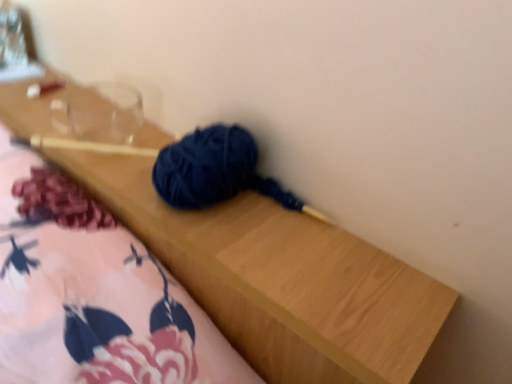
The height and width of the screenshot is (384, 512). What do you see at coordinates (93, 298) in the screenshot?
I see `fluffy pink blanket at lower left` at bounding box center [93, 298].

Image resolution: width=512 pixels, height=384 pixels. What do you see at coordinates (11, 37) in the screenshot?
I see `transparent glass jar at upper left` at bounding box center [11, 37].

This screenshot has height=384, width=512. In order to click on fluffy pink blanket at lower left in this screenshot , I will do `click(93, 298)`.

From the image's perspective, which object appears higher, transparent glass jar at upper left or transparent glass at upper left?

From the image's view, transparent glass jar at upper left is above.

Locate an element on the screen. Image resolution: width=512 pixels, height=384 pixels. clear below the transparent glass jar at upper left (from the image's perspective) is located at coordinates (99, 113).

In terms of width, does transparent glass jar at upper left look wider or thinner when compared to transparent glass at upper left?

Clearly, transparent glass jar at upper left has more width compared to transparent glass at upper left.

Based on their sizes in the image, would you say transparent glass jar at upper left is bigger or smaller than transparent glass at upper left?

Considering their sizes, transparent glass jar at upper left takes up more space than transparent glass at upper left.

Is transparent glass jar at upper left in front of or behind fluffy pink blanket at lower left in the image?

Clearly, transparent glass jar at upper left is behind fluffy pink blanket at lower left.

From a real-world perspective, is transparent glass jar at upper left physically below fluffy pink blanket at lower left?

No, from a real-world perspective, transparent glass jar at upper left is not beneath fluffy pink blanket at lower left.

Is point (18, 35) positioned behind point (163, 278)?

Yes, it is.

Is transparent glass jar at upper left at the right side of fluffy pink blanket at lower left?

In fact, transparent glass jar at upper left is to the left of fluffy pink blanket at lower left.

From the image's perspective, is fluffy pink blanket at lower left located above transparent glass at upper left?

No, from the image's perspective, fluffy pink blanket at lower left is not over transparent glass at upper left.

Between fluffy pink blanket at lower left and transparent glass at upper left, which one has more height?

With more height is fluffy pink blanket at lower left.

Considering the positions of objects fluffy pink blanket at lower left and transparent glass at upper left in the image provided, who is more to the right, fluffy pink blanket at lower left or transparent glass at upper left?

fluffy pink blanket at lower left.

This screenshot has height=384, width=512. What are the coordinates of `clear on the left of fluffy pink blanket at lower left` in the screenshot? It's located at (99, 113).

From a real-world perspective, is transparent glass at upper left positioned above or below fluffy pink blanket at lower left?

Clearly, from a real-world perspective, transparent glass at upper left is above fluffy pink blanket at lower left.

Is transparent glass at upper left not inside fluffy pink blanket at lower left?

Yes, transparent glass at upper left is located beyond the bounds of fluffy pink blanket at lower left.

Which object is more forward, transparent glass at upper left or fluffy pink blanket at lower left?

fluffy pink blanket at lower left is closer to the camera.

Does transparent glass at upper left have a lesser width compared to fluffy pink blanket at lower left?

Yes, transparent glass at upper left is thinner than fluffy pink blanket at lower left.

Is transparent glass at upper left facing towards transparent glass jar at upper left?

No, transparent glass at upper left is not turned towards transparent glass jar at upper left.

Where is `clear in front of the transparent glass jar at upper left`? clear in front of the transparent glass jar at upper left is located at coordinates 99,113.

From a real-world perspective, who is located lower, transparent glass at upper left or transparent glass jar at upper left?

From a 3D spatial view, transparent glass at upper left is below.

Looking at this image, considering the positions of objects transparent glass at upper left and transparent glass jar at upper left in the image provided, who is more to the right, transparent glass at upper left or transparent glass jar at upper left?

transparent glass at upper left is more to the right.

Considering the positions of point (75, 253) and point (24, 59), is point (75, 253) closer or farther from the camera than point (24, 59)?

Point (75, 253).

Could you tell me if fluffy pink blanket at lower left is facing transparent glass jar at upper left?

No.

Is fluffy pink blanket at lower left taller than transparent glass jar at upper left?

Indeed, fluffy pink blanket at lower left has a greater height compared to transparent glass jar at upper left.

Which of these two, fluffy pink blanket at lower left or transparent glass jar at upper left, is thinner?

transparent glass jar at upper left is thinner.

Identify the location of glass jar located above the transparent glass at upper left (from the image's perspective). The image size is (512, 384). (11, 37).

Identify the location of blanket to the right of transparent glass jar at upper left. (93, 298).

When comparing their distances from transparent glass at upper left, does transparent glass jar at upper left or fluffy pink blanket at lower left seem further?

fluffy pink blanket at lower left is positioned further to the anchor transparent glass at upper left.

From the image, which object appears to be nearer to fluffy pink blanket at lower left, transparent glass at upper left or transparent glass jar at upper left?

The object closer to fluffy pink blanket at lower left is transparent glass at upper left.

Considering their positions, is transparent glass jar at upper left positioned further to fluffy pink blanket at lower left than transparent glass at upper left?

transparent glass jar at upper left.

Looking at the image, which one is located closer to transparent glass jar at upper left, transparent glass at upper left or fluffy pink blanket at lower left?

transparent glass at upper left is positioned closer to the anchor transparent glass jar at upper left.

From the image, which object appears to be nearer to transparent glass jar at upper left, fluffy pink blanket at lower left or transparent glass at upper left?

transparent glass at upper left is positioned closer to the anchor transparent glass jar at upper left.

From the image, which object appears to be nearer to transparent glass at upper left, fluffy pink blanket at lower left or transparent glass jar at upper left?

Among the two, transparent glass jar at upper left is located nearer to transparent glass at upper left.

Image resolution: width=512 pixels, height=384 pixels. Identify the location of clear positioned between fluffy pink blanket at lower left and transparent glass jar at upper left from near to far. (99, 113).